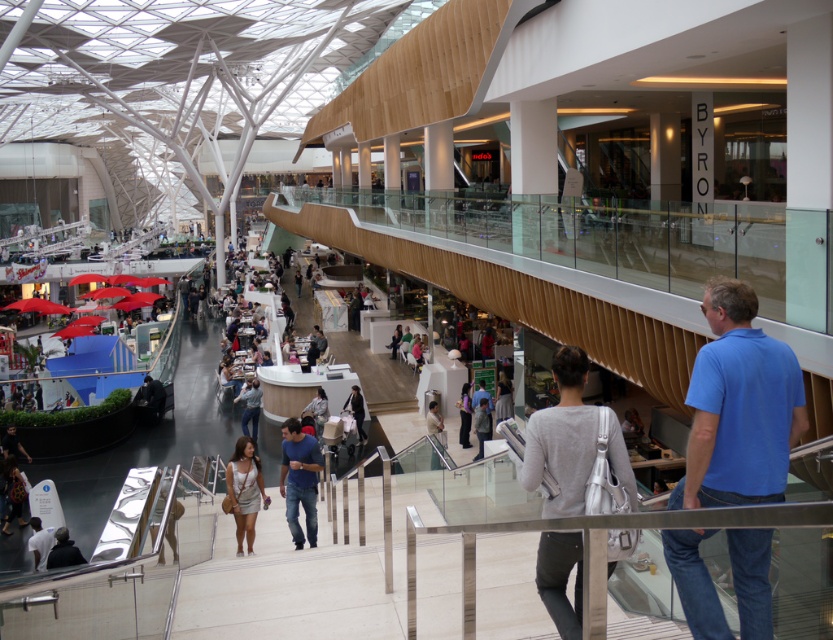
You are a customer in the mall and you see two pairs of pants hanging at the center of the store. The dark gray pants at center and the matte black pants at center. Which pair is hanging above the other?

The dark gray pants at center is positioned under matte black pants at center, so the matte black pants at center is hanging above the dark gray pants at center.

You are a store manager organizing a display in the mall. You have a black leather jacket at center and a matte black pants at center. Which item should you place on the lower shelf if you want to follow the rule of putting larger items on higher shelves?

The black leather jacket at center is bigger than the matte black pants at center, so you should place the black leather jacket at center on the higher shelf and the matte black pants at center on the lower shelf to follow the rule.